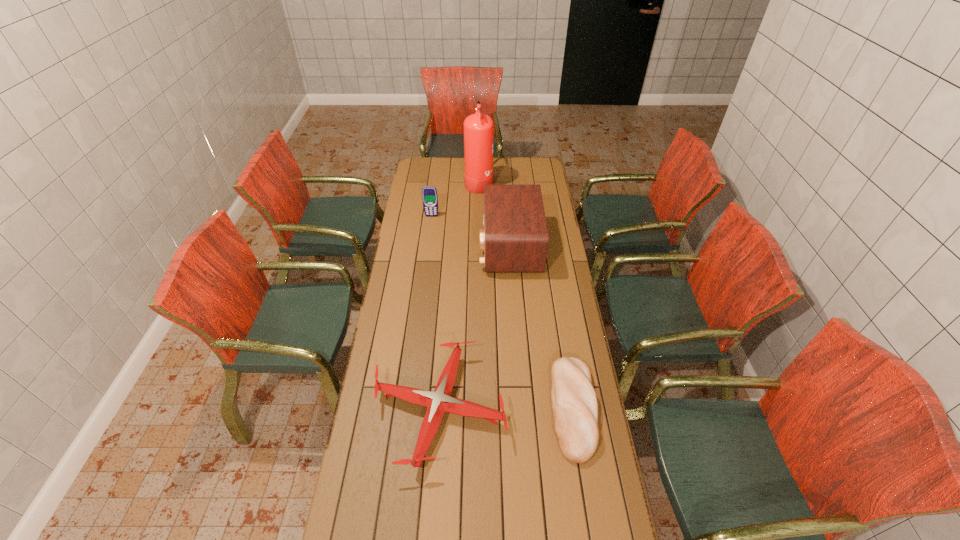
Find the location of `vacant space at the far edge of the desktop`. vacant space at the far edge of the desktop is located at coordinates (448, 171).

Identify the location of vacant position at the left edge of the desktop. (415, 363).

Image resolution: width=960 pixels, height=540 pixels. I want to click on vacant space at the right edge of the desktop, so click(x=577, y=481).

Identify the location of free space between the drone and the radio receiver. (474, 328).

Locate an element on the screen. This screenshot has width=960, height=540. free space that is in between the second farthest object and the third farthest object is located at coordinates (470, 231).

Locate an element on the screen. Image resolution: width=960 pixels, height=540 pixels. vacant space that is in between the bread and the third tallest object is located at coordinates (502, 312).

Where is `free area in between the third shortest object and the drone`? free area in between the third shortest object and the drone is located at coordinates (436, 313).

This screenshot has width=960, height=540. I want to click on empty space that is in between the bread and the third shortest object, so click(x=502, y=312).

This screenshot has width=960, height=540. I want to click on object that is the fourth closest one to the fourth shortest object, so click(x=574, y=402).

Point out which object is positioned as the fourth nearest to the cellular telephone. Please provide its 2D coordinates. Your answer should be formatted as a tuple, i.e. [(x, y)], where the tuple contains the x and y coordinates of a point satisfying the conditions above.

[(574, 402)]